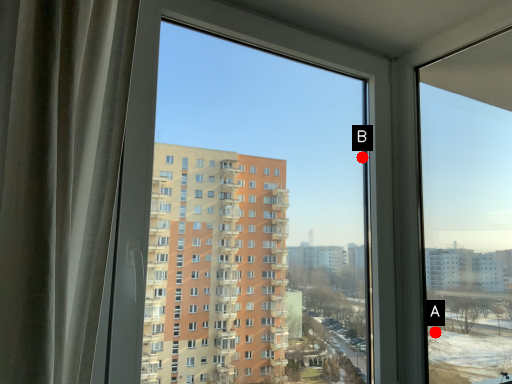
Question: Two points are circled on the image, labeled by A and B beside each circle. Among these points, which one is farthest from the camera?

Choices:
 (A) A is further
 (B) B is further

Answer: (B)